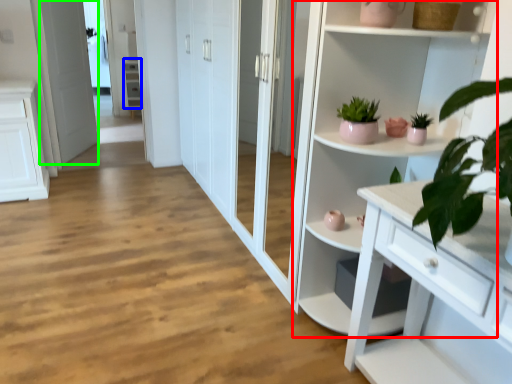
Question: Which object is the closest to the cupboard (highlighted by a red box)? Choose among these: cabinet (highlighted by a blue box) or screen door (highlighted by a green box).

Choices:
 (A) cabinet
 (B) screen door

Answer: (B)